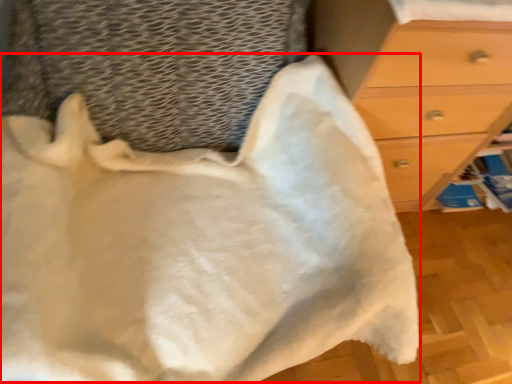
Question: From the image's perspective, considering the relative positions of blanket (annotated by the red box) and chest of drawers in the image provided, where is blanket (annotated by the red box) located with respect to the staircase?

Choices:
 (A) above
 (B) below

Answer: (B)